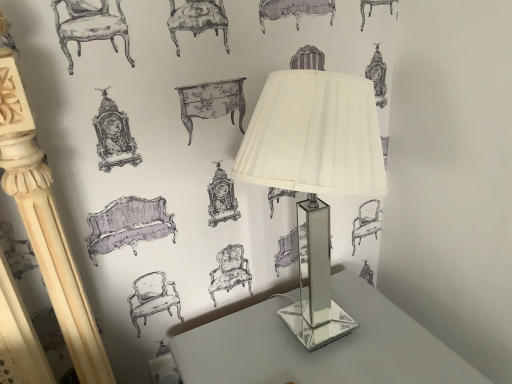
At what (x,y) coordinates should I click in order to perform the action: click on free region under clear glass lamp at center (from a real-world perspective). Please return your answer as a coordinate pair (x, y). Image resolution: width=512 pixels, height=384 pixels. Looking at the image, I should click on (315, 345).